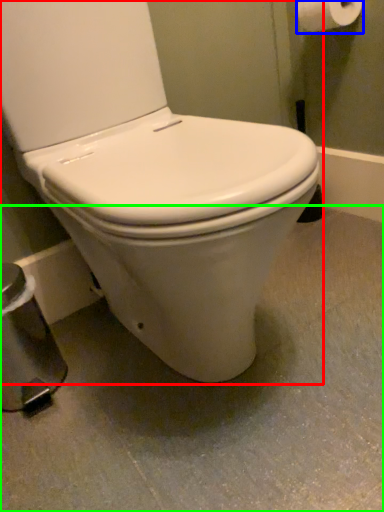
Question: Which object is positioned closest to toilet (highlighted by a red box)? Select from toilet paper (highlighted by a blue box) and concrete (highlighted by a green box).

Choices:
 (A) toilet paper
 (B) concrete

Answer: (B)